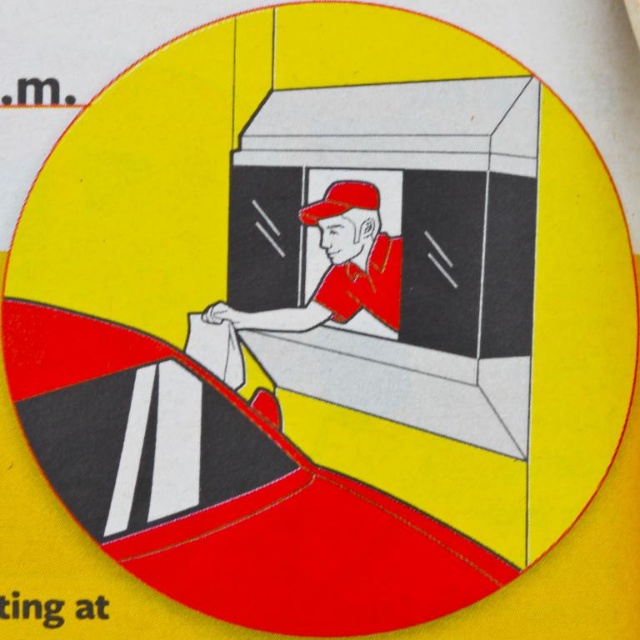
Which is in front, point (384, 310) or point (353, 188)?

Point (353, 188)

Is matte red uniform at center to the right of red matte baseball cap at center from the viewer's perspective?

Incorrect, matte red uniform at center is not on the right side of red matte baseball cap at center.

Is point (371, 186) in front of point (352, 195)?

Yes, point (371, 186) is closer to viewer.

You are a GUI agent. You are given a task and a screenshot of the screen. Output one action in this format:
    pyautogui.click(x=<x>, y=<y>)
    Task: Click on the matte red uniform at center
    
    Given the screenshot: What is the action you would take?
    pyautogui.click(x=339, y=269)